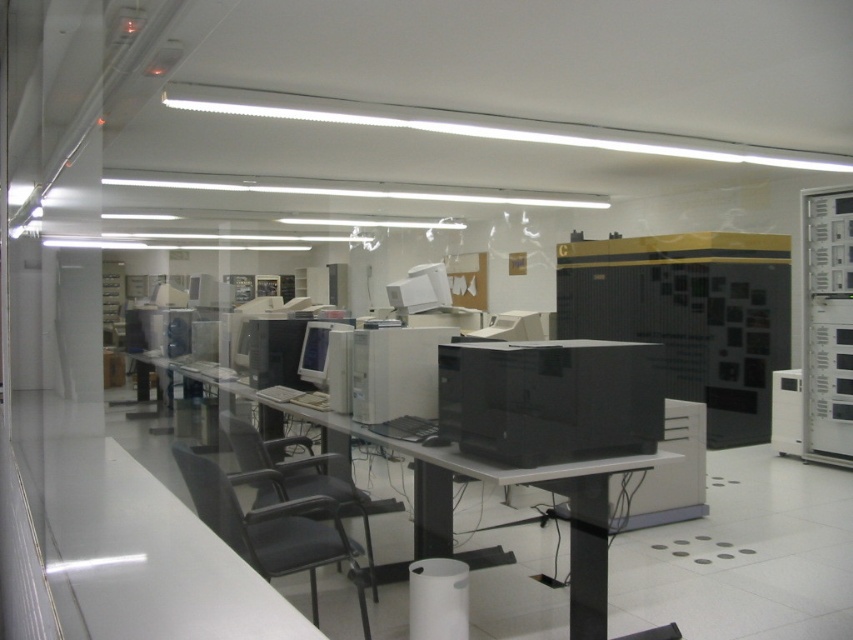
Does black plastic table at center appear on the right side of matte gray monitor at center?

Yes, black plastic table at center is to the right of matte gray monitor at center.

Is black plastic table at center taller than matte gray monitor at center?

Yes.

Is point (432, 538) positioned in front of point (325, 346)?

Yes.

At what (x,y) coordinates should I click in order to perform the action: click on black plastic table at center. Please return your answer as a coordinate pair (x, y). Looking at the image, I should click on (479, 477).

Does point (508, 456) come in front of point (338, 490)?

Yes, it is in front of point (338, 490).

From the picture: Between black matte desktop computer at center and black fabric swivel chair at center, which one has less height?

With less height is black matte desktop computer at center.

Is point (550, 356) farther from viewer compared to point (346, 490)?

No.

The width and height of the screenshot is (853, 640). I want to click on black matte desktop computer at center, so click(x=549, y=400).

Is black matte desktop computer at center further to camera compared to black plastic table at center?

Yes, it is.

Measure the distance between black matte desktop computer at center and camera.

The distance of black matte desktop computer at center from camera is 8.71 feet.

Identify the location of black matte desktop computer at center. The width and height of the screenshot is (853, 640). (549, 400).